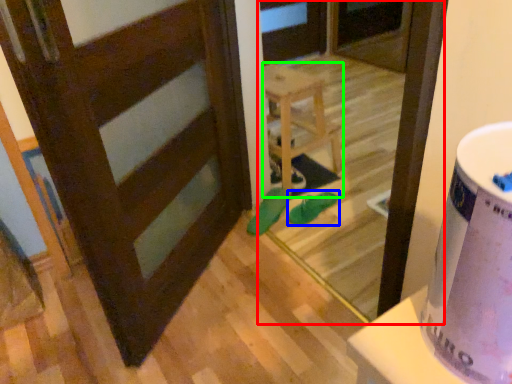
Question: Based on their relative distances, which object is nearer to screen door (highlighted by a red box)? Choose from footwear (highlighted by a blue box) and furniture (highlighted by a green box).

Choices:
 (A) footwear
 (B) furniture

Answer: (B)